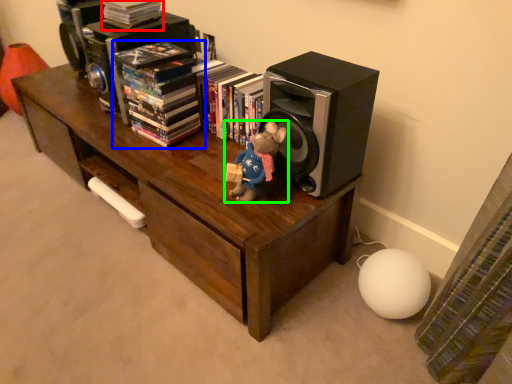
Question: Estimate the real-world distances between objects in this image. Which object is closer to book (highlighted by a red box), book (highlighted by a blue box) or toy (highlighted by a green box)?

Choices:
 (A) book
 (B) toy

Answer: (A)